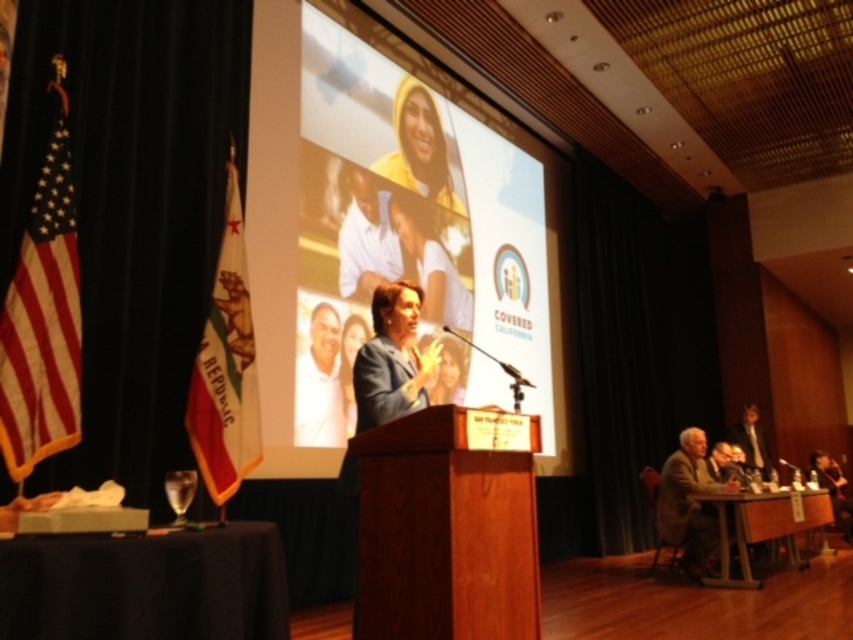
Which is above, matte blue suit at center or dark brown leather jacket at lower right?

Positioned higher is matte blue suit at center.

Locate an element on the screen. matte blue suit at center is located at coordinates (392, 358).

Is point (383, 384) farther from viewer compared to point (822, 456)?

No, it is in front of (822, 456).

Where is `matte blue suit at center`? The height and width of the screenshot is (640, 853). matte blue suit at center is located at coordinates (392, 358).

Which of these two, matte blue suit at center or light brown wooden chair at lower right, stands shorter?

matte blue suit at center

Between matte blue suit at center and light brown wooden chair at lower right, which one is positioned lower?

Positioned lower is light brown wooden chair at lower right.

Is point (384, 284) positioned in front of point (763, 452)?

That is True.

The image size is (853, 640). What are the coordinates of `matte blue suit at center` in the screenshot? It's located at (392, 358).

How distant is matte plastic screen at center from light brown wooden chair at lower right?

matte plastic screen at center is 3.54 meters away from light brown wooden chair at lower right.

Does matte plastic screen at center have a lesser width compared to light brown wooden chair at lower right?

No, matte plastic screen at center is not thinner than light brown wooden chair at lower right.

Is point (380, 157) more distant than point (735, 433)?

No, (380, 157) is closer to viewer.

Find the location of a particular element. The height and width of the screenshot is (640, 853). matte plastic screen at center is located at coordinates (426, 202).